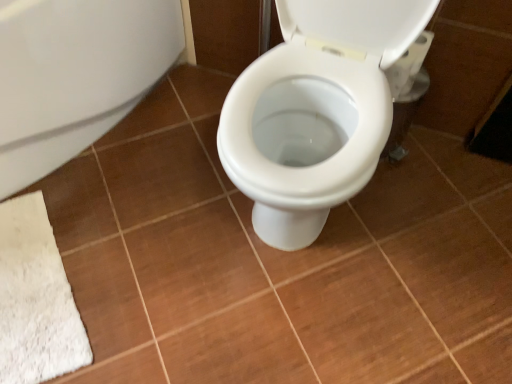
Question: Is white matte bath at lower left at the left side of white matte toilet paper at upper right?

Choices:
 (A) no
 (B) yes

Answer: (B)

Question: Is white matte toilet paper at upper right a part of white matte bath at lower left?

Choices:
 (A) no
 (B) yes

Answer: (A)

Question: From a real-world perspective, is white matte bath at lower left under white matte toilet paper at upper right?

Choices:
 (A) no
 (B) yes

Answer: (B)

Question: From the image's perspective, is white matte bath at lower left on top of white matte toilet paper at upper right?

Choices:
 (A) yes
 (B) no

Answer: (B)

Question: Can you confirm if white matte bath at lower left is bigger than white matte toilet paper at upper right?

Choices:
 (A) no
 (B) yes

Answer: (B)

Question: Is white matte bath at lower left positioned beyond the bounds of white matte toilet paper at upper right?

Choices:
 (A) yes
 (B) no

Answer: (A)

Question: From a real-world perspective, does white matte toilet paper at upper right stand above white matte bath at lower left?

Choices:
 (A) yes
 (B) no

Answer: (A)

Question: Is white matte toilet paper at upper right oriented towards white matte bath at lower left?

Choices:
 (A) yes
 (B) no

Answer: (B)

Question: Would you consider white matte toilet paper at upper right to be distant from white matte bath at lower left?

Choices:
 (A) no
 (B) yes

Answer: (A)

Question: Is white matte toilet paper at upper right smaller than white matte bath at lower left?

Choices:
 (A) yes
 (B) no

Answer: (A)

Question: From a real-world perspective, is white matte toilet paper at upper right under white matte bath at lower left?

Choices:
 (A) no
 (B) yes

Answer: (A)

Question: Is white matte toilet paper at upper right with white matte bath at lower left?

Choices:
 (A) no
 (B) yes

Answer: (A)

Question: Relative to white matte bath at lower left, is white matte toilet paper at upper right in front or behind?

Choices:
 (A) front
 (B) behind

Answer: (B)